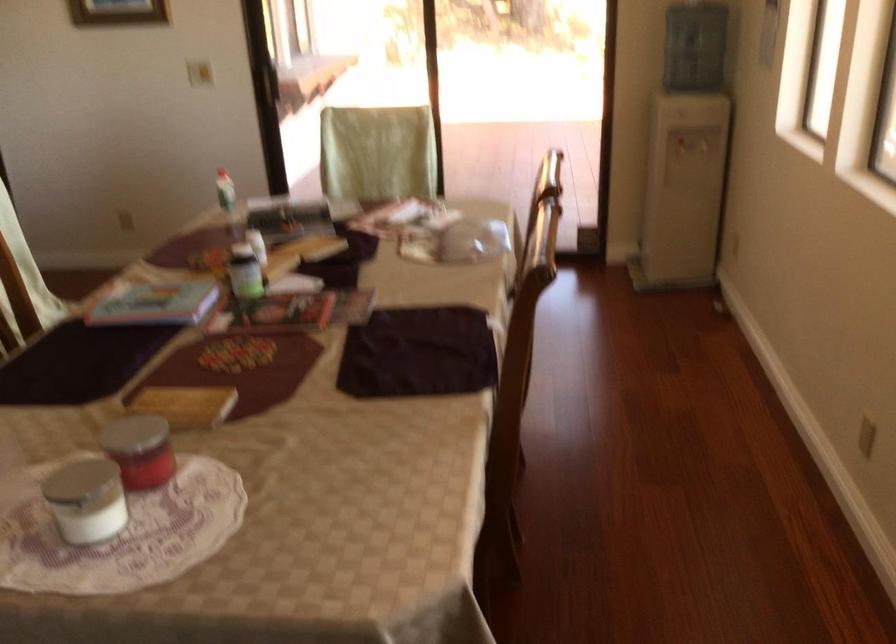
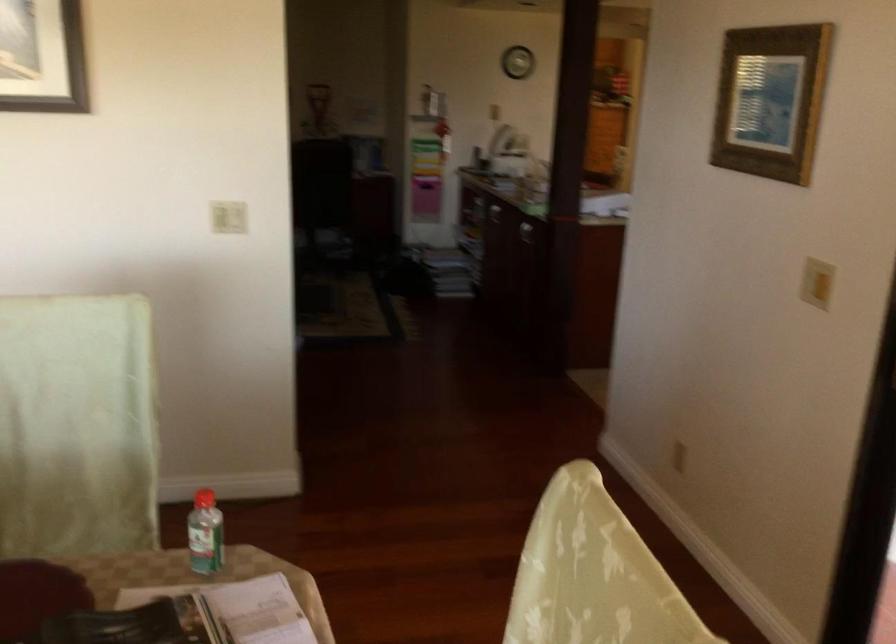
Find the pixel in the second image that matches [221,185] in the first image.

(204, 534)